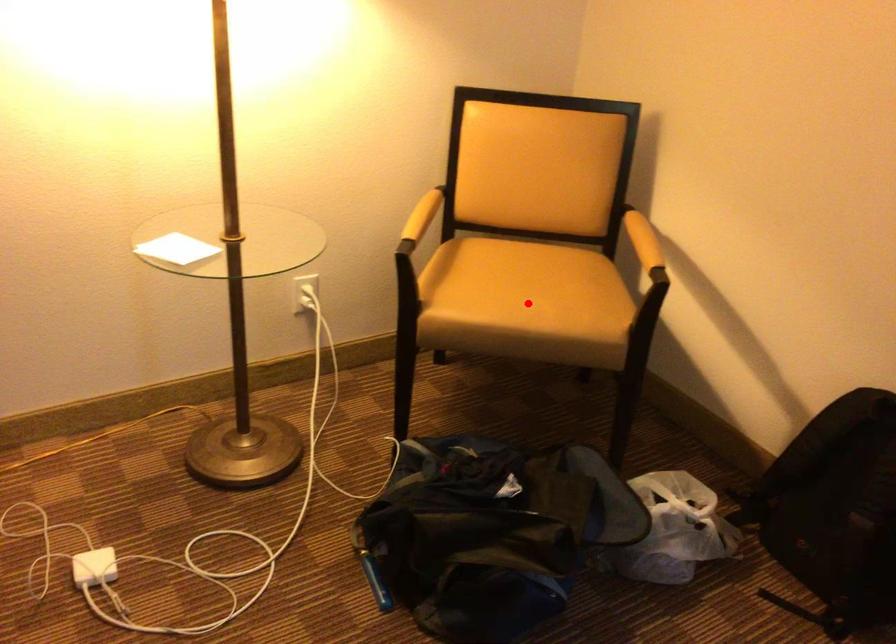
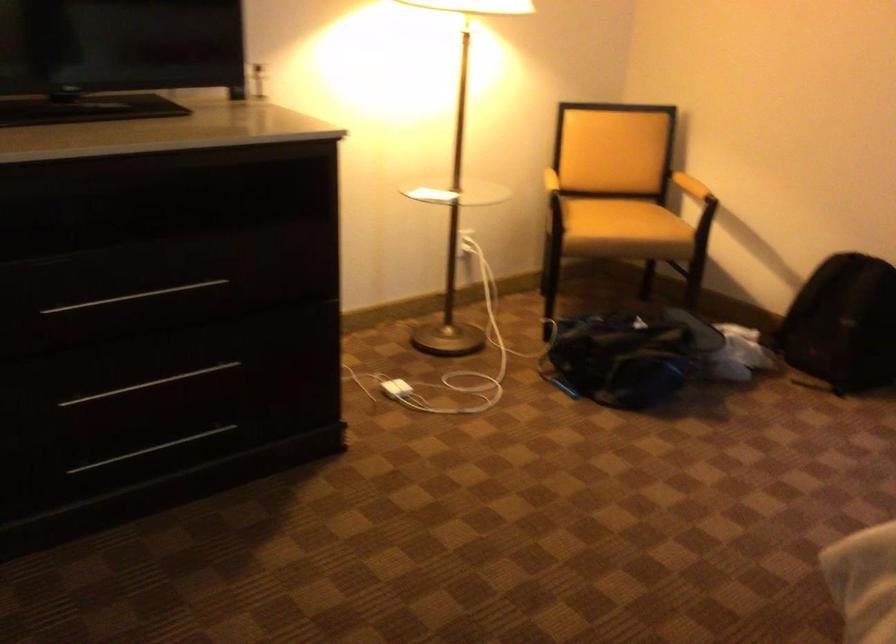
Question: I am providing you with two images of the same scene from different viewpoints. In image1, a red point is highlighted. Considering the same 3D point in image2, which of the following is correct?

Choices:
 (A) It is closer
 (B) It is farther

Answer: (B)